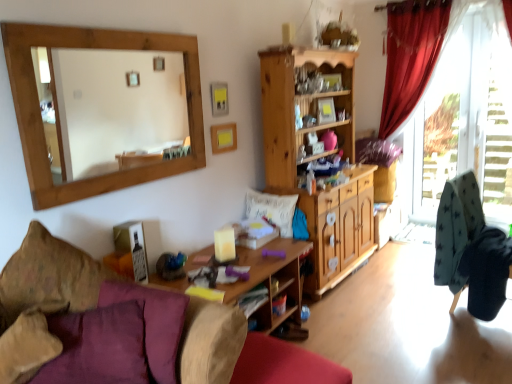
The height and width of the screenshot is (384, 512). I want to click on free location above wooden mirror at upper left (from a real-world perspective), so click(105, 26).